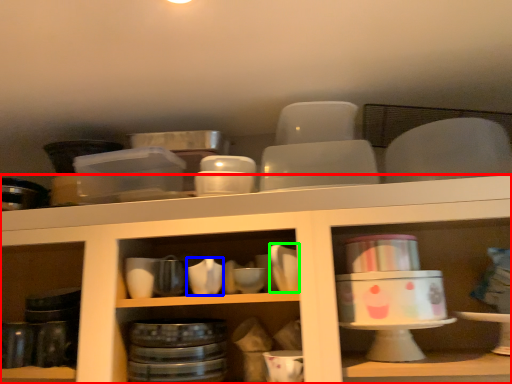
Question: Which object is the closest to the shelf (highlighted by a red box)? Choose among these: tableware (highlighted by a blue box) or tableware (highlighted by a green box).

Choices:
 (A) tableware
 (B) tableware

Answer: (B)